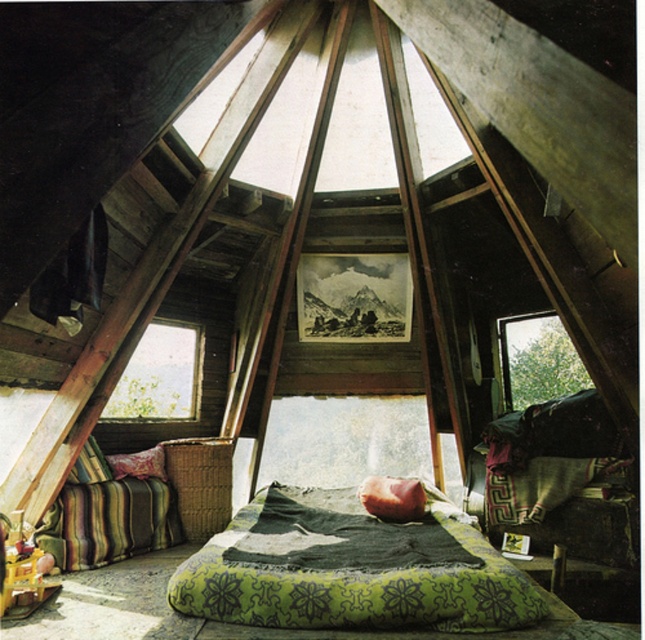
You are organizing a cozy reading corner in the attic and want to place a small table between the green textured fabric bed at center and the velvet green pillow at lower left. Based on their positions, is the table likely to fit horizontally between them?

The green textured fabric bed at center is positioned under the velvet green pillow at lower left, meaning they are aligned vertically rather than horizontally. Therefore, placing a table between them horizontally would not be feasible as they are stacked vertically rather than side by side.

You are standing in the rustic attic room and want to place a small decorative item on one of two specific points marked on the floor. The first point is at coordinates point (422, 552) and the second is at point (137, 456). Which point is closer to you, the viewer?

Point (422, 552) is closer to the viewer than point (137, 456).